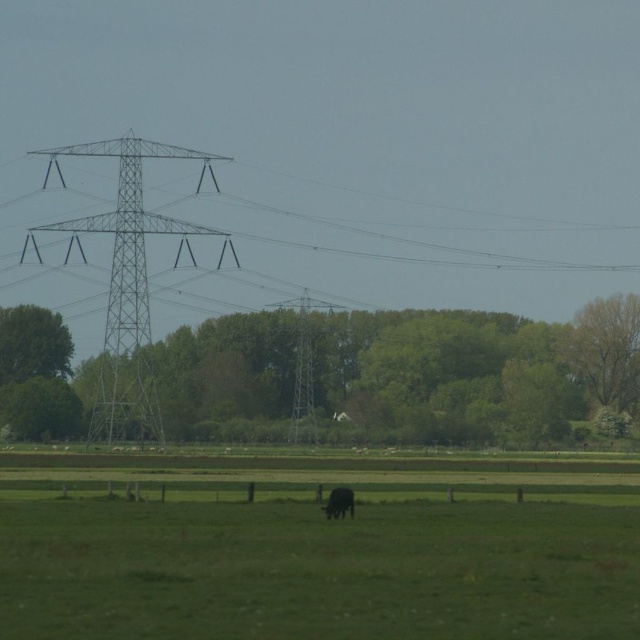
You are standing at the point labeled as point (317, 547) in the image. What do you see around you?

You are standing on the green grass pasture at lower center.

You are a farmer standing in the field looking at the metallic silver tower at center and the black furry cow at lower center. Which object is higher from the ground?

The metallic silver tower at center is higher from the ground than the black furry cow at lower center because the description states that the metallic silver tower at center is above the black furry cow at lower center.

You are a farmer who wants to move your tractor from the barn to the green grass pasture at lower center. The metallic gray tower at left is in the way. Can you drive around it on the right side?

The metallic gray tower at left has guy wires extending across the frame, so driving around it on the right side may not be possible due to the wires obstructing the path.